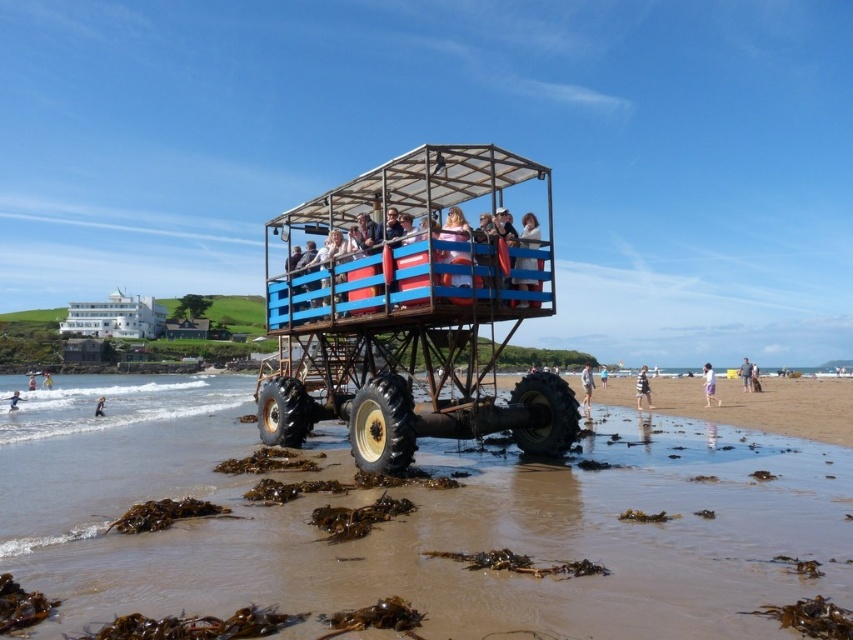
You are a photographer standing at the camera position. You want to take a photo of the metallic blue monster truck at center. If you move forward 10 feet, will the truck be closer to the camera than 20 feet?

The metallic blue monster truck at center is initially 28.11 feet away. Moving forward 10 feet reduces the distance to 18.11 feet, which is less than 20 feet. Therefore, yes, the truck will be closer than 20 feet after moving forward.

You are standing on the beach and want to take a photo of both the point at (647, 403) and the point at (587, 408). Which point should you focus on first to ensure both are in the same frame?

You should focus on the point at (587, 408) first because it is closer to you than the point at (647, 403), allowing both to be captured in the same frame.